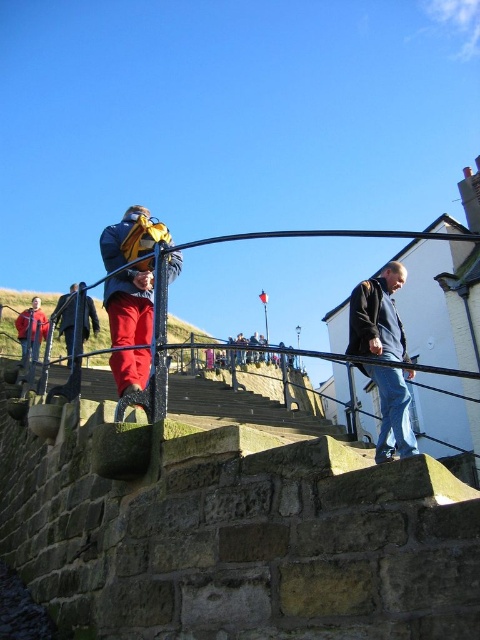
You are standing at the bottom of the stone steps and see two people wearing red jackets. The first person is wearing a matte red jacket at center, and the second person is wearing a red fabric jacket at upper left. Which person is closer to you?

The matte red jacket at center is smaller than the red fabric jacket at upper left, so the person wearing the matte red jacket at center is closer to you.

You are standing at the bottom of the stone steps and want to hand a note to both the person in the matte red jacket at center and the person in the red fabric jacket at upper left. If you can throw the note 35 feet, will you be able to reach both people with one throw?

The matte red jacket at center and red fabric jacket at upper left are 37.25 feet apart, which is beyond your 35 feet throwing range. You cannot reach both with a single throw.